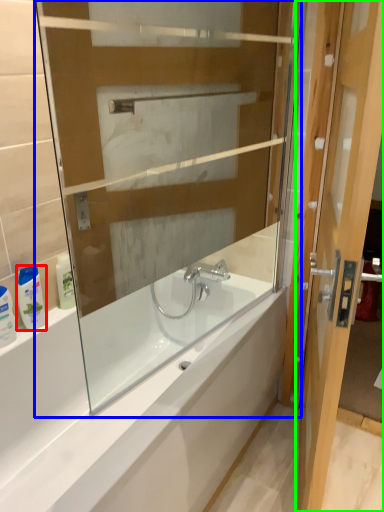
Question: Which object is positioned farthest from toiletry (highlighted by a red box)? Select from glass box (highlighted by a blue box) and door (highlighted by a green box).

Choices:
 (A) glass box
 (B) door

Answer: (B)